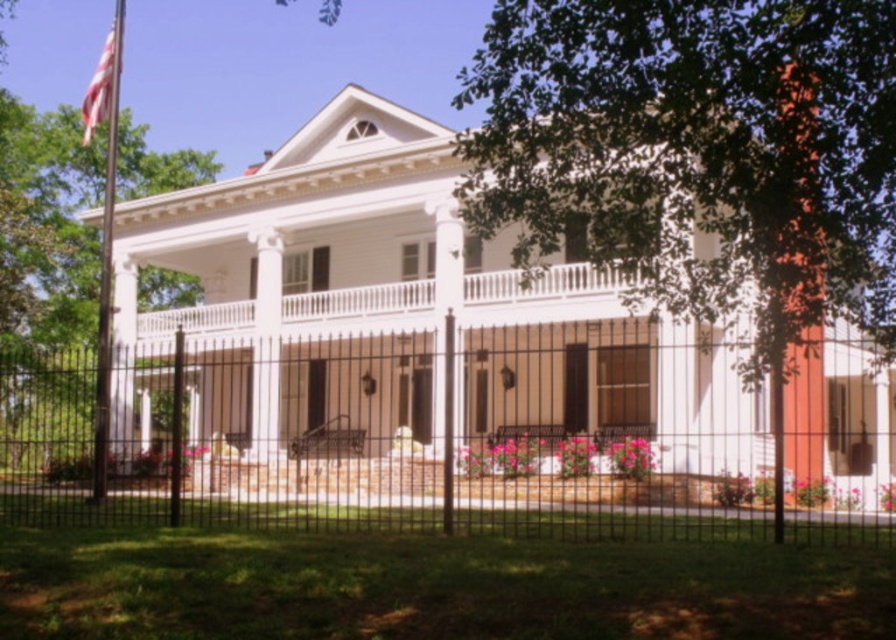
Which of these two, black wrought iron fence at center or american flag at upper left, stands shorter?

black wrought iron fence at center is shorter.

Does black wrought iron fence at center come behind american flag at upper left?

Result: No.

The image size is (896, 640). I want to click on black wrought iron fence at center, so click(x=438, y=442).

Is black wrought iron fence at center below metallic flag pole at left?

Correct, black wrought iron fence at center is located below metallic flag pole at left.

Which is below, black wrought iron fence at center or metallic flag pole at left?

Positioned lower is black wrought iron fence at center.

What do you see at coordinates (438, 442) in the screenshot? The width and height of the screenshot is (896, 640). I see `black wrought iron fence at center` at bounding box center [438, 442].

Find the location of `black wrought iron fence at center`. black wrought iron fence at center is located at coordinates (438, 442).

Is point (876, 12) in front of point (112, 52)?

Yes.

Where is `green leafy tree at upper right`? The height and width of the screenshot is (640, 896). green leafy tree at upper right is located at coordinates (699, 157).